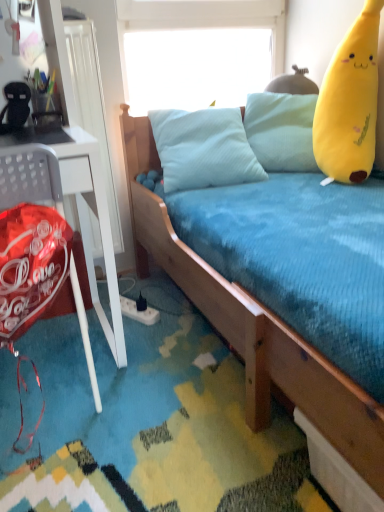
Question: Is shiny red balloon at left further to camera compared to wooden bed at center?

Choices:
 (A) yes
 (B) no

Answer: (A)

Question: Is shiny red balloon at left wider than wooden bed at center?

Choices:
 (A) yes
 (B) no

Answer: (B)

Question: From the image's perspective, is shiny red balloon at left over wooden bed at center?

Choices:
 (A) yes
 (B) no

Answer: (B)

Question: Does shiny red balloon at left have a smaller size compared to wooden bed at center?

Choices:
 (A) yes
 (B) no

Answer: (A)

Question: Is wooden bed at center surrounded by shiny red balloon at left?

Choices:
 (A) yes
 (B) no

Answer: (B)

Question: Choose the correct answer: Is wooden bed at center inside shiny red balloon at left or outside it?

Choices:
 (A) outside
 (B) inside

Answer: (A)

Question: From the image's perspective, is wooden bed at center above or below shiny red balloon at left?

Choices:
 (A) below
 (B) above

Answer: (B)

Question: Considering the positions of wooden bed at center and shiny red balloon at left in the image, is wooden bed at center bigger or smaller than shiny red balloon at left?

Choices:
 (A) big
 (B) small

Answer: (A)

Question: Looking at their shapes, would you say wooden bed at center is wider or thinner than shiny red balloon at left?

Choices:
 (A) wide
 (B) thin

Answer: (A)

Question: From a real-world perspective, is wooden bed at center positioned above or below transparent plastic window screen at upper center?

Choices:
 (A) below
 (B) above

Answer: (A)

Question: From the image's perspective, is wooden bed at center located above or below transparent plastic window screen at upper center?

Choices:
 (A) below
 (B) above

Answer: (A)

Question: Is point (345, 490) positioned closer to the camera than point (268, 62)?

Choices:
 (A) farther
 (B) closer

Answer: (B)

Question: Is wooden bed at center situated inside transparent plastic window screen at upper center or outside?

Choices:
 (A) outside
 (B) inside

Answer: (A)

Question: From a real-world perspective, is shiny red balloon at left physically located above or below wooden bed at center?

Choices:
 (A) above
 (B) below

Answer: (B)

Question: In the image, is shiny red balloon at left positioned in front of or behind wooden bed at center?

Choices:
 (A) behind
 (B) front

Answer: (A)